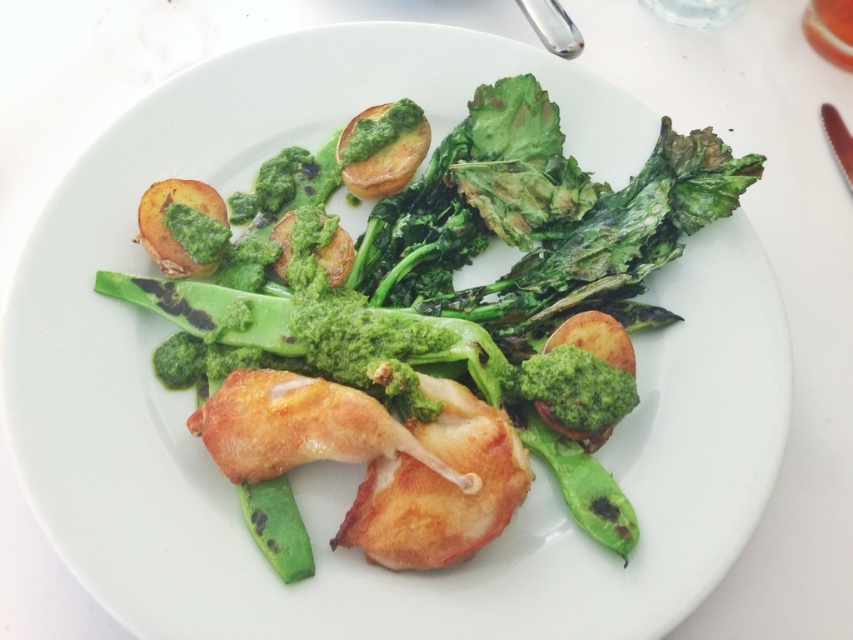
You are a food critic standing 1.5 meters away from the dish. Can you see the green smooth broccoli at center clearly from your current position?

The green smooth broccoli at center is 1.24 meters away from the camera, so since you are standing 1.5 meters away, you are slightly farther than the broccoli. However, the broccoli is still within a reasonable viewing distance, so yes, you can see it clearly.

Consider the image. You are standing in a kitchen and see a plate with vegetables and grilled chicken. There is a point at coordinates point (579,390). If you want to place a small bowl 1 meter away from this point, will it fit on the counter without overlapping any other items?

The distance between point (579,390) and the viewer is 1.25 meters. Since the bowl needs to be placed 1 meter away from the point, it would be within reach and likely fit on the counter without overlapping other items, assuming there is enough space on the counter.